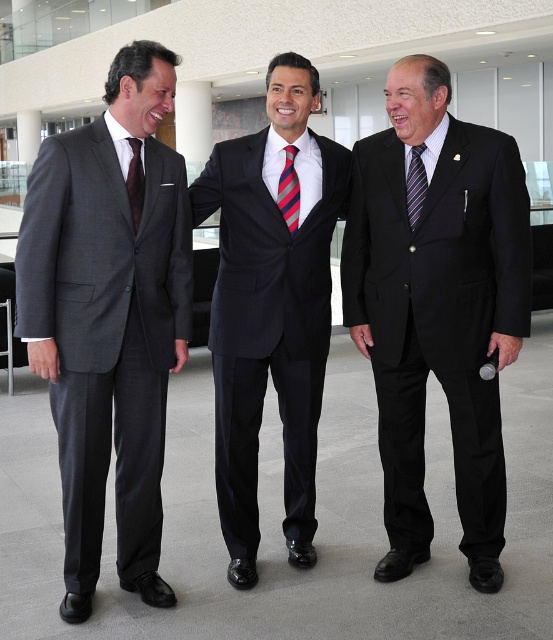
Based on the photo, you are a photographer at a formal event. You need to adjust the lighting to ensure both the black smooth suit at center and the dark brown silk tie at left are well lit. Based on their positions, which one might require more direct lighting to avoid shadows?

The dark brown silk tie at left might require more direct lighting because it is above the black smooth suit at center, so it could be in a shadowed area depending on the light source direction.